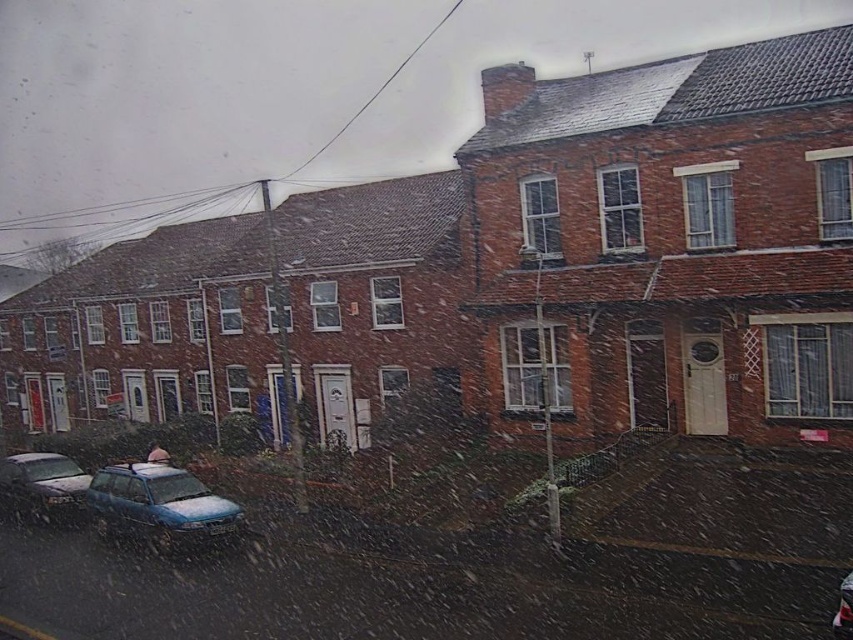
Question: Which of the following is the closest to the observer?

Choices:
 (A) (840, 628)
 (B) (24, 493)

Answer: (A)

Question: Can you confirm if metallic blue sedan at lower left is positioned below metallic blue car at lower left?

Choices:
 (A) no
 (B) yes

Answer: (B)

Question: Can you confirm if metallic blue sedan at lower left is wider than metallic blue car at lower left?

Choices:
 (A) no
 (B) yes

Answer: (B)

Question: Is blue matte car at lower left to the right of metallic blue sedan at lower left from the viewer's perspective?

Choices:
 (A) yes
 (B) no

Answer: (A)

Question: Which object is the closest to the metallic blue sedan at lower left?

Choices:
 (A) blue matte car at lower left
 (B) metallic blue car at lower left

Answer: (A)

Question: Which point is farther from the camera taking this photo?

Choices:
 (A) (831, 621)
 (B) (6, 465)

Answer: (B)